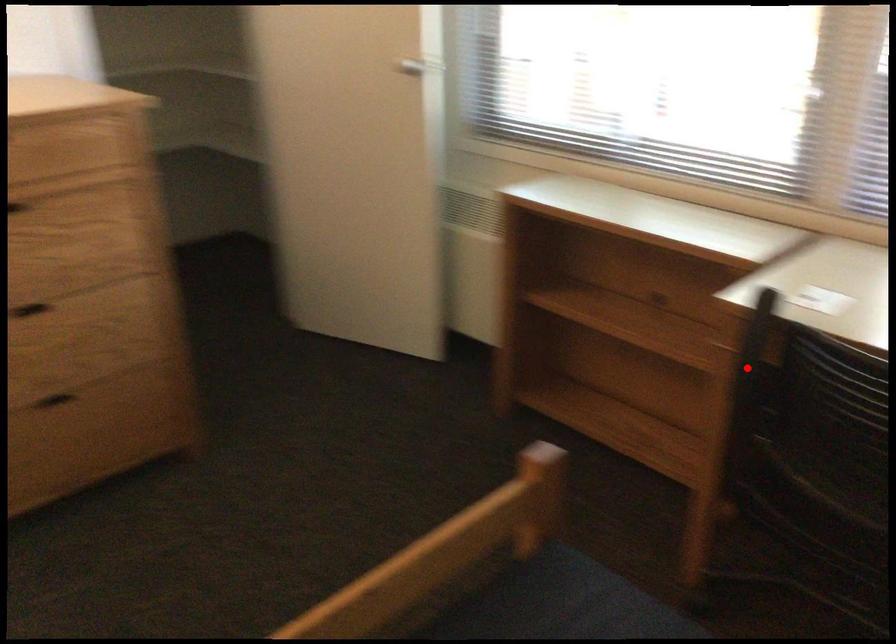
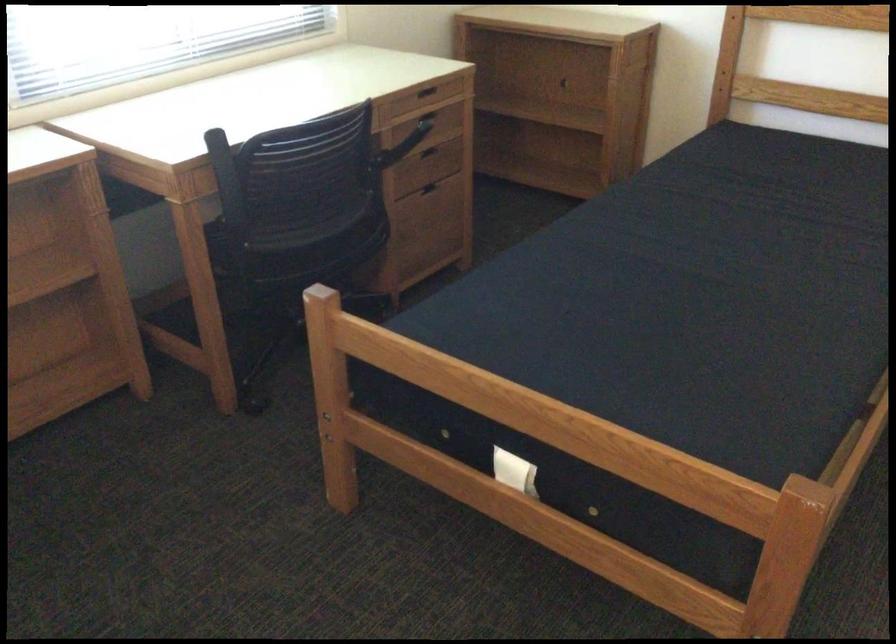
Question: I am providing you with two images of the same scene from different viewpoints. Given a red point in image1, look at the same physical point in image2. Is it:

Choices:
 (A) Closer to the viewpoint
 (B) Farther from the viewpoint

Answer: (B)